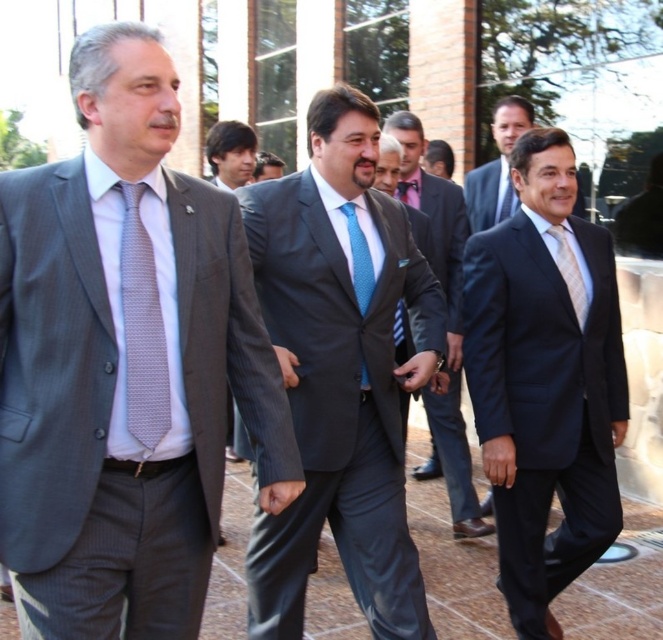
Question: Is dark blue suit at center positioned before blue dotted tie at center?

Choices:
 (A) yes
 (B) no

Answer: (B)

Question: Considering the relative positions of blue silk suit at center and light blue silk tie at center in the image provided, where is blue silk suit at center located with respect to light blue silk tie at center?

Choices:
 (A) above
 (B) below

Answer: (B)

Question: Can you confirm if blue silk suit at center is positioned to the right of blue textured tie at center?

Choices:
 (A) yes
 (B) no

Answer: (B)

Question: Among these objects, which one is nearest to the camera?

Choices:
 (A) blue textured tie at center
 (B) white silk tie at center
 (C) matte gray suit at left

Answer: (C)

Question: Which point is farther to the camera?

Choices:
 (A) (564, 316)
 (B) (219, 163)

Answer: (B)

Question: Which of the following is the closest to the observer?

Choices:
 (A) (186, 445)
 (B) (491, 385)
 (C) (294, 602)

Answer: (A)